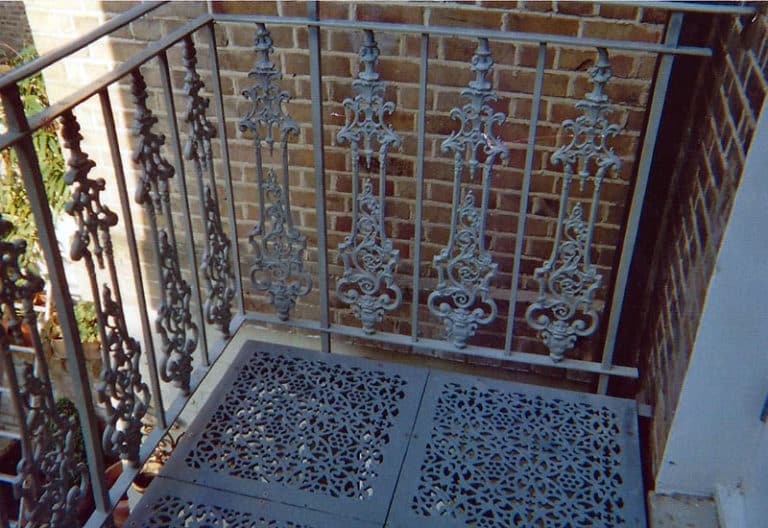
At what (x,y) coordinates should I click in order to perform the action: click on floor. Please return your answer as a coordinate pair (x, y). This screenshot has height=528, width=768. Looking at the image, I should click on (528, 470), (325, 435), (190, 515).